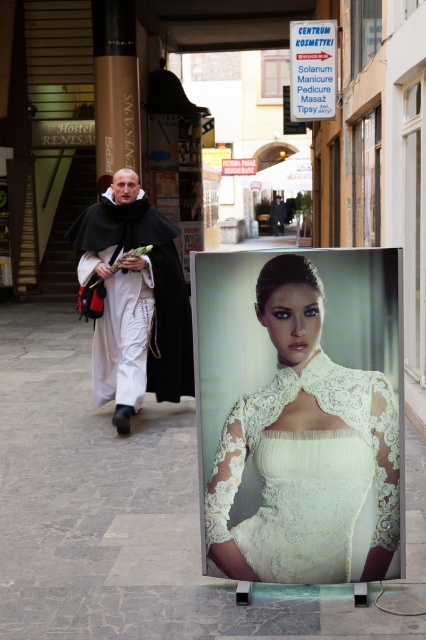
Question: Does gray stone pavement at center have a larger size compared to white lace dress at center?

Choices:
 (A) yes
 (B) no

Answer: (A)

Question: From the image, what is the correct spatial relationship of white woolen robe at center in relation to white lace billboard at center?

Choices:
 (A) right
 (B) left

Answer: (B)

Question: Which object is positioned farthest from the white lace billboard at center?

Choices:
 (A) white lace dress at center
 (B) gray stone pavement at center
 (C) white woolen robe at center

Answer: (A)

Question: Which of these objects is positioned farthest from the white woolen robe at center?

Choices:
 (A) gray stone pavement at center
 (B) white lace billboard at center
 (C) white lace dress at center

Answer: (B)

Question: Among these points, which one is farthest from the camera?

Choices:
 (A) (138, 355)
 (B) (213, 579)
 (C) (325, 72)
 (D) (365, 544)

Answer: (C)

Question: Can you confirm if gray stone pavement at center is bigger than white lace billboard at center?

Choices:
 (A) yes
 (B) no

Answer: (A)